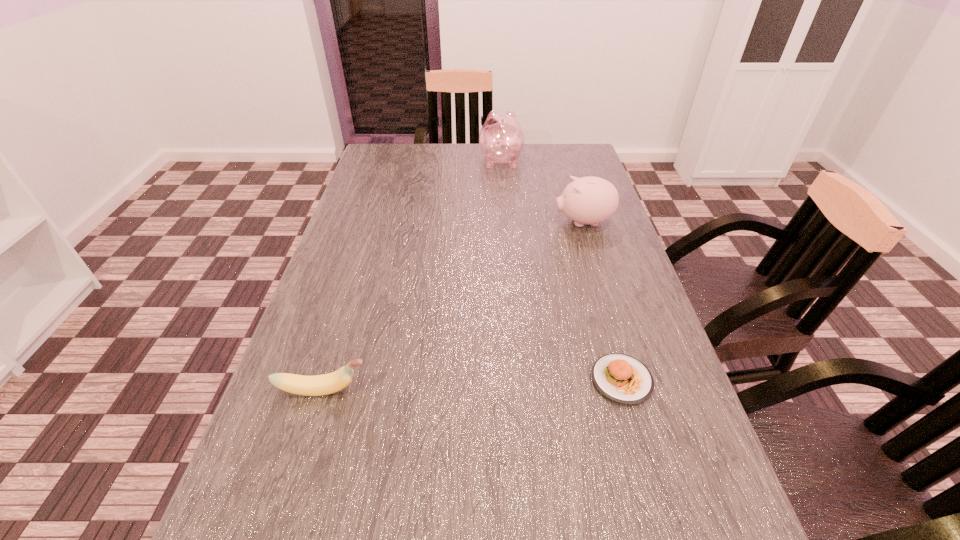
What are the coordinates of `the farther piggy bank` in the screenshot? It's located at (501, 139).

At what (x,y) coordinates should I click in order to perform the action: click on the left piggy bank. Please return your answer as a coordinate pair (x, y). This screenshot has height=540, width=960. Looking at the image, I should click on (501, 139).

Find the location of `the second farthest object`. the second farthest object is located at coordinates (590, 200).

Identify the location of the right piggy bank. (590, 200).

Identify the location of the leftmost object. The width and height of the screenshot is (960, 540). (318, 385).

Locate an element on the screen. The width and height of the screenshot is (960, 540). banana is located at coordinates (318, 385).

Where is `food`? The height and width of the screenshot is (540, 960). food is located at coordinates (622, 378).

Identify the location of vacant space positioned at the snout of the right piggy bank. (419, 222).

Where is `free space located at the snout of the right piggy bank`? free space located at the snout of the right piggy bank is located at coordinates (461, 222).

Find the location of `vacant space located 0.180m at the snout of the right piggy bank`. vacant space located 0.180m at the snout of the right piggy bank is located at coordinates (490, 222).